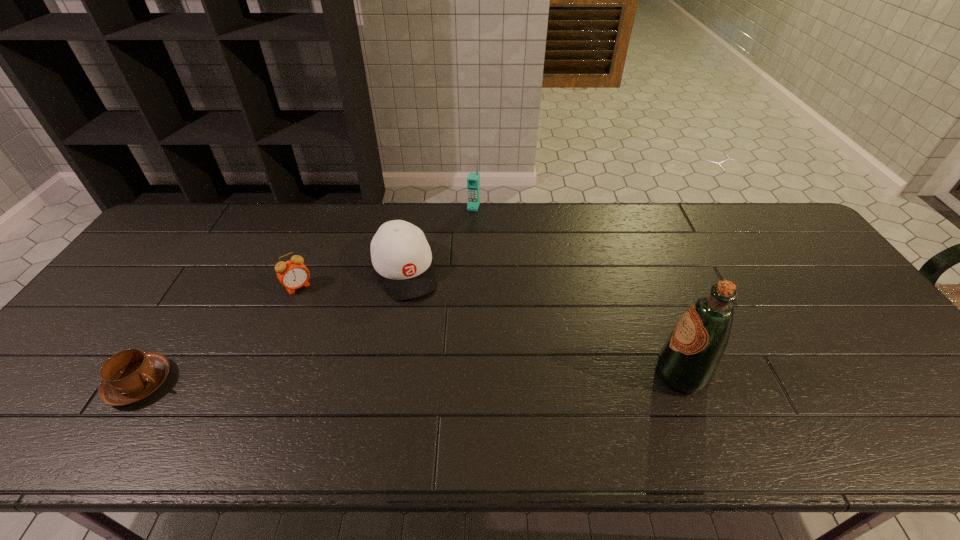
I want to click on object that can be found as the third closest to the olive oil, so click(x=293, y=274).

This screenshot has height=540, width=960. Identify the location of vacant region that satisfies the following two spatial constraints: 1. on the front side of the olive oil; 2. on the front-facing side of the third object from left to right. tap(386, 375).

Locate an element on the screen. free space that satisfies the following two spatial constraints: 1. on the back side of the alarm clock; 2. on the right side of the third object from right to left is located at coordinates (304, 271).

Image resolution: width=960 pixels, height=540 pixels. I want to click on free spot that satisfies the following two spatial constraints: 1. on the front side of the olive oil; 2. on the front-facing side of the alarm clock, so click(261, 375).

Locate an element on the screen. free space that satisfies the following two spatial constraints: 1. on the back side of the cellular telephone; 2. on the right side of the alarm clock is located at coordinates (331, 207).

Find the location of `free space in the image that satisfies the following two spatial constraints: 1. on the back side of the fourth object from left to right; 2. on the right side of the alarm clock`. free space in the image that satisfies the following two spatial constraints: 1. on the back side of the fourth object from left to right; 2. on the right side of the alarm clock is located at coordinates point(331,207).